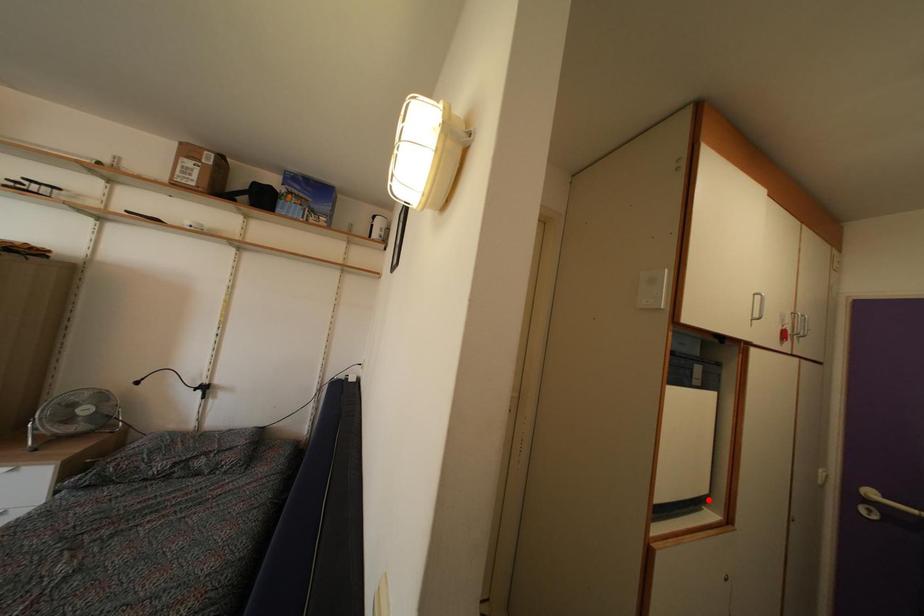
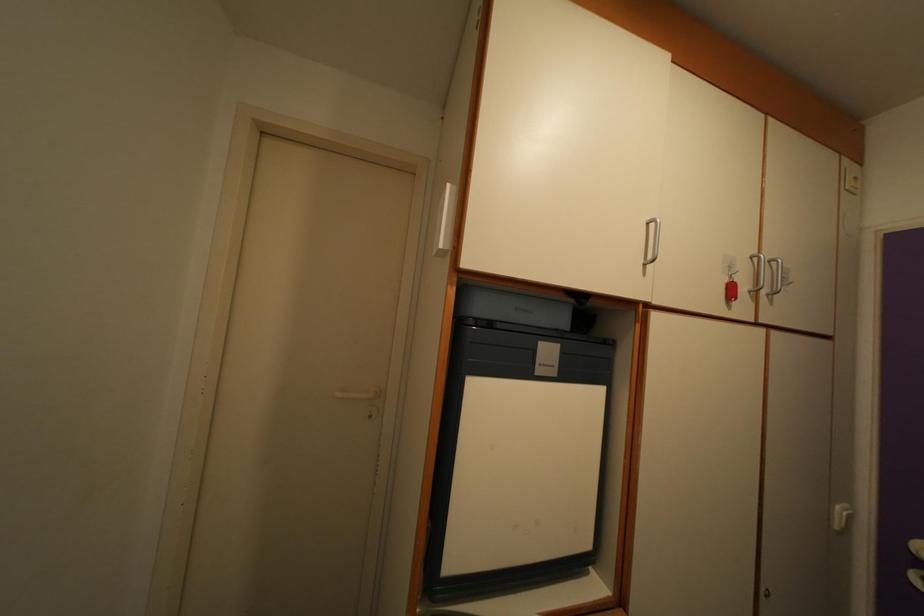
Find the pixel in the second image that matches the highlighted location in the first image.

(591, 554)